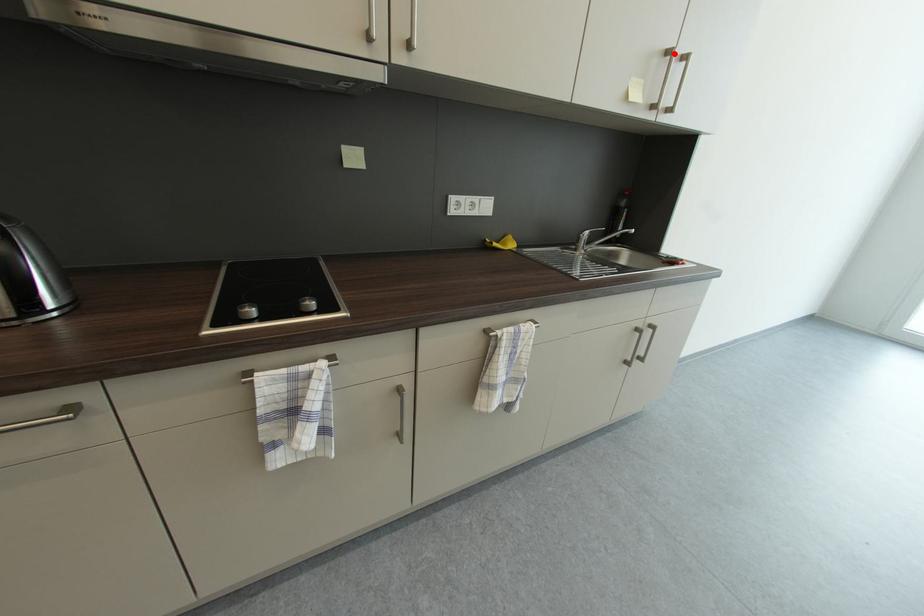
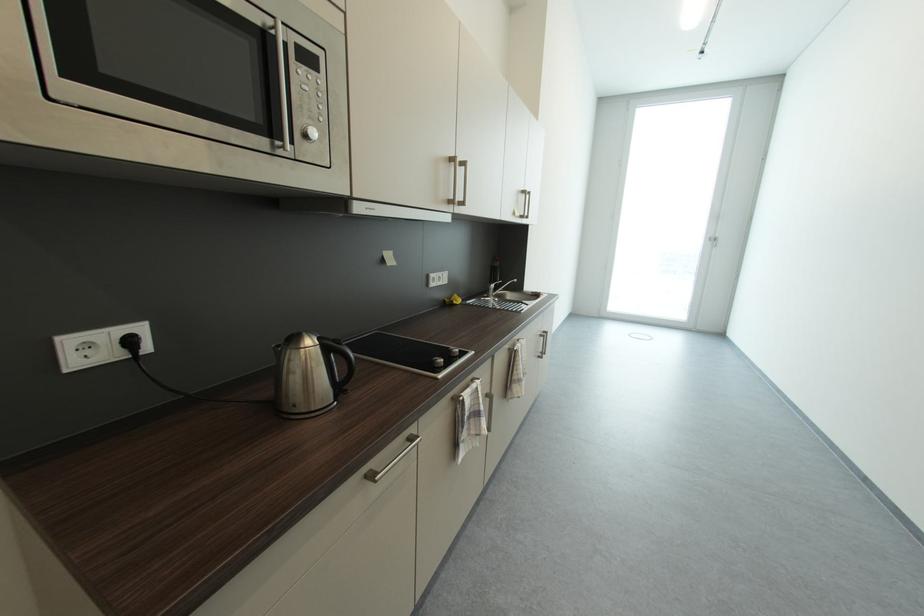
Where in the second image is the point corresponding to the highlighted location from the first image?

(529, 193)